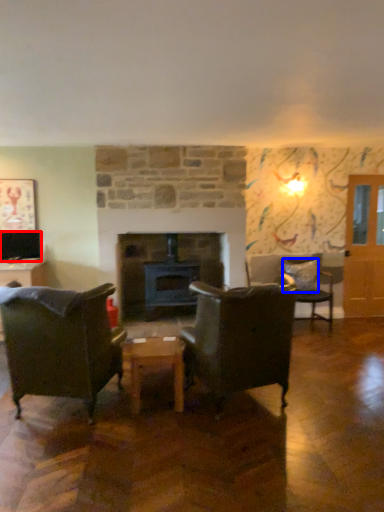
Question: Which object appears farthest to the camera in this image, television (highlighted by a red box) or pillow (highlighted by a blue box)?

Choices:
 (A) television
 (B) pillow

Answer: (B)